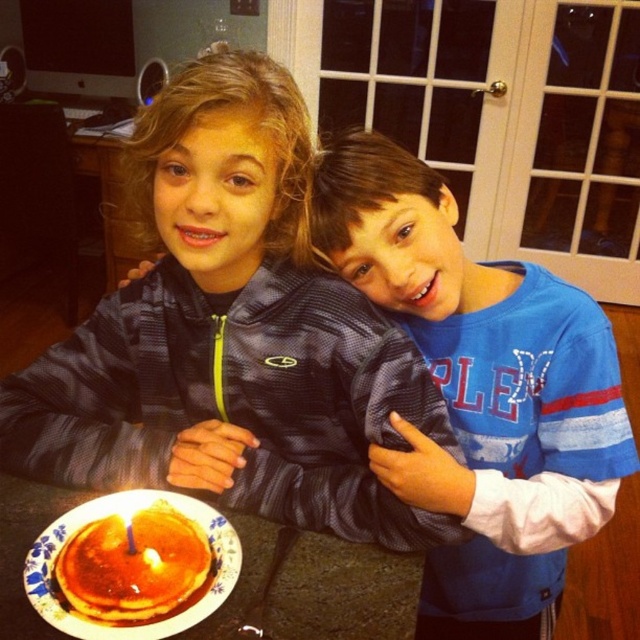
Question: Can you confirm if blue fabric jacket at center is smaller than blue jersey at center?

Choices:
 (A) yes
 (B) no

Answer: (B)

Question: Which point appears closest to the camera in this image?

Choices:
 (A) (323, 538)
 (B) (186, 528)

Answer: (B)

Question: Is white paper plate at lower left behind golden syrup pancake at lower left?

Choices:
 (A) no
 (B) yes

Answer: (A)

Question: Estimate the real-world distances between objects in this image. Which object is closer to the white paper plate at lower left?

Choices:
 (A) yellow wax candle at lower left
 (B) white wax candle at lower left
 (C) blue jersey at center
 (D) blue fabric jacket at center

Answer: (B)

Question: Does white paper plate at lower left have a lesser width compared to white wax candle at lower left?

Choices:
 (A) yes
 (B) no

Answer: (B)

Question: Estimate the real-world distances between objects in this image. Which object is farther from the blue jersey at center?

Choices:
 (A) white wax candle at lower left
 (B) white paper plate at lower left
 (C) golden syrup pancake at lower left

Answer: (A)